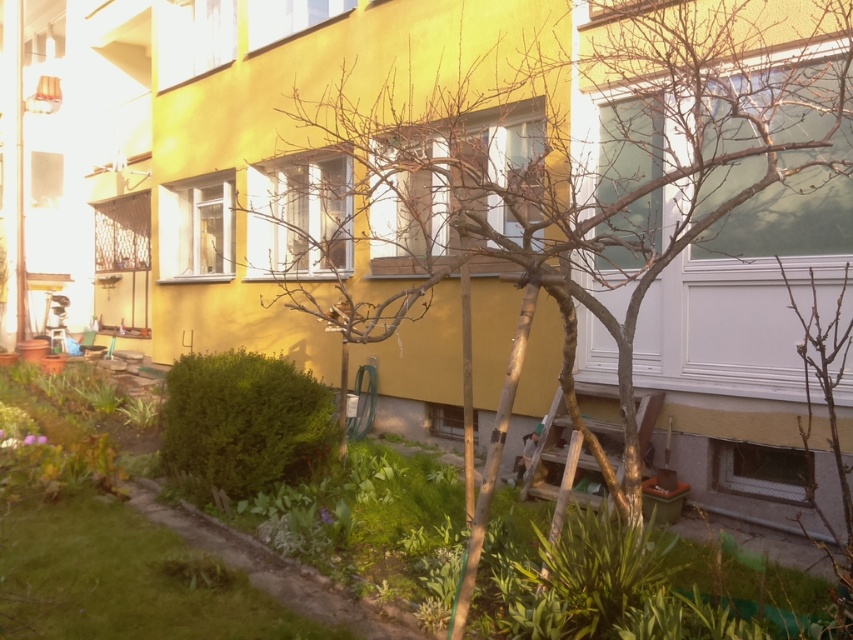
Question: Is bare wood tree at center closer to the viewer compared to green grass at lower left?

Choices:
 (A) yes
 (B) no

Answer: (A)

Question: Does bare wood tree at center have a larger size compared to green grass at lower left?

Choices:
 (A) yes
 (B) no

Answer: (A)

Question: Is bare wood tree at center smaller than green grass at lower left?

Choices:
 (A) yes
 (B) no

Answer: (B)